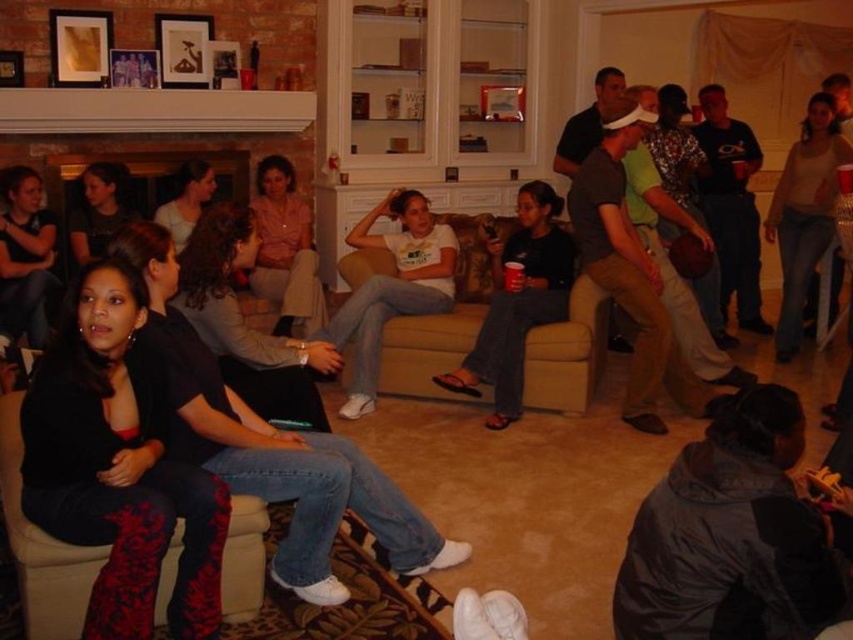
Is dark gray fleece jacket at lower right above matte black shirt at center?

Incorrect, dark gray fleece jacket at lower right is not positioned above matte black shirt at center.

Does dark gray fleece jacket at lower right have a greater width compared to matte black shirt at center?

Indeed, dark gray fleece jacket at lower right has a greater width compared to matte black shirt at center.

Is point (643, 618) closer to camera compared to point (91, 176)?

Yes.

At what (x,y) coordinates should I click in order to perform the action: click on dark gray fleece jacket at lower right. Please return your answer as a coordinate pair (x, y). The height and width of the screenshot is (640, 853). Looking at the image, I should click on (730, 536).

Between dark gray fleece jacket at lower right and matte gray sweater at center, which one appears on the left side from the viewer's perspective?

From the viewer's perspective, matte gray sweater at center appears more on the left side.

Can you confirm if dark gray fleece jacket at lower right is smaller than matte gray sweater at center?

No, dark gray fleece jacket at lower right is not smaller than matte gray sweater at center.

Which is behind, point (740, 589) or point (194, 202)?

Point (194, 202)

The image size is (853, 640). In order to click on dark gray fleece jacket at lower right in this screenshot , I will do `click(730, 536)`.

Is dark gray fleece jacket at lower right bigger than white cotton t-shirt at center?

Incorrect, dark gray fleece jacket at lower right is not larger than white cotton t-shirt at center.

Does dark gray fleece jacket at lower right appear under white cotton t-shirt at center?

Correct, dark gray fleece jacket at lower right is located below white cotton t-shirt at center.

What do you see at coordinates (730, 536) in the screenshot? I see `dark gray fleece jacket at lower right` at bounding box center [730, 536].

This screenshot has width=853, height=640. I want to click on dark gray fleece jacket at lower right, so click(730, 536).